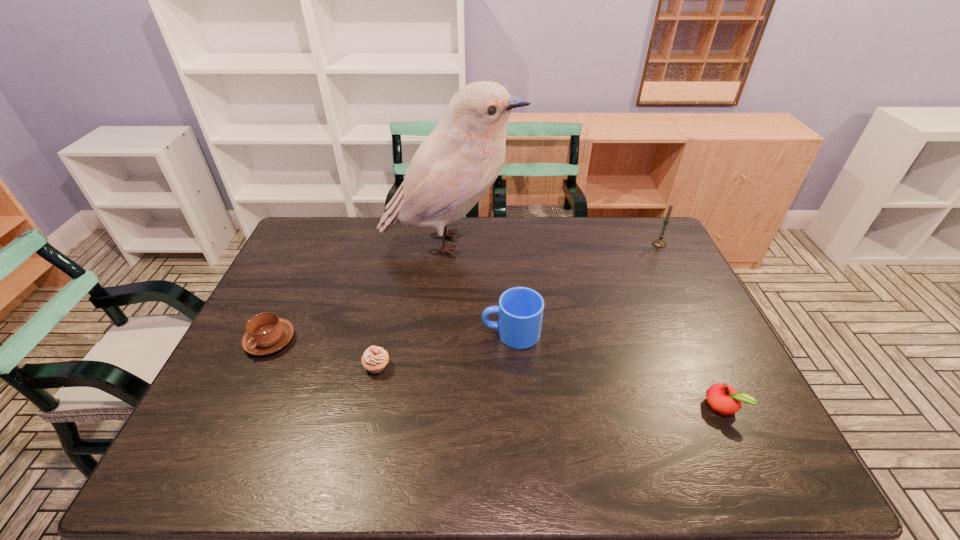
Image resolution: width=960 pixels, height=540 pixels. I want to click on free space that satisfies the following two spatial constraints: 1. on the side of the cupcake with the handle; 2. on the right side of the leftmost object, so click(258, 366).

Find the location of a particular element. The width and height of the screenshot is (960, 540). free space that satisfies the following two spatial constraints: 1. on the back side of the fifth shortest object; 2. on the left side of the apple is located at coordinates (646, 244).

Locate an element on the screen. The width and height of the screenshot is (960, 540). blank area in the image that satisfies the following two spatial constraints: 1. on the side of the third shortest object with the handle; 2. on the right side of the cappuccino is located at coordinates (258, 366).

You are a GUI agent. You are given a task and a screenshot of the screen. Output one action in this format:
    pyautogui.click(x=<x>, y=<y>)
    Task: Click on the free space that satisfies the following two spatial constraints: 1. on the side of the nearest object with the handle; 2. on the right side of the cappuccino
    The image size is (960, 540).
    Given the screenshot: What is the action you would take?
    pyautogui.click(x=240, y=406)

Where is `vacant area that satisfies the following two spatial constraints: 1. on the side of the cupcake with the handle; 2. on the left side of the leftmost object`? This screenshot has height=540, width=960. vacant area that satisfies the following two spatial constraints: 1. on the side of the cupcake with the handle; 2. on the left side of the leftmost object is located at coordinates (258, 366).